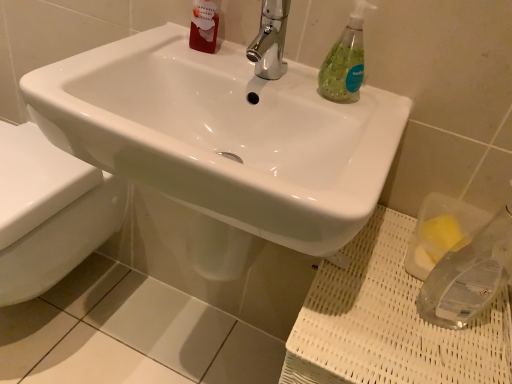
Find the location of `empty space that is in between green translucent soap dispenser at upper right and translucent red liquid at upper left`. empty space that is in between green translucent soap dispenser at upper right and translucent red liquid at upper left is located at coordinates (256, 72).